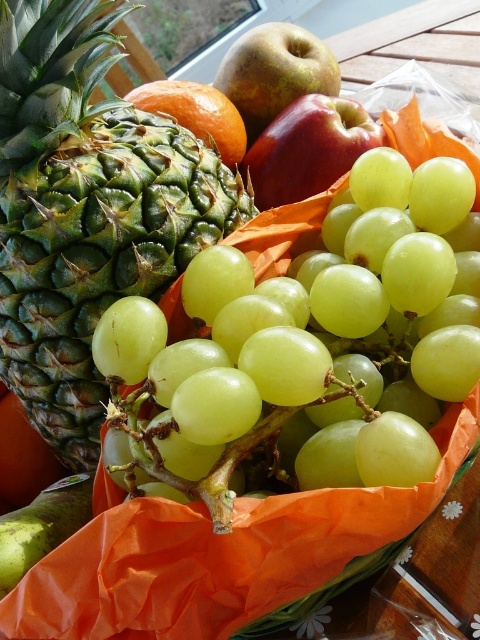
Does shiny red apple at center have a smaller size compared to orange matte at center?

Correct, shiny red apple at center occupies less space than orange matte at center.

Is shiny red apple at center to the right of orange matte at center from the viewer's perspective?

Indeed, shiny red apple at center is positioned on the right side of orange matte at center.

Between point (347, 140) and point (195, 108), which one is positioned behind?

The point (195, 108) is behind.

Locate an element on the screen. The image size is (480, 640). shiny red apple at center is located at coordinates (308, 148).

Which is more to the left, green textured pineapple at upper left or orange matte at center?

From the viewer's perspective, green textured pineapple at upper left appears more on the left side.

Can you confirm if green textured pineapple at upper left is positioned to the right of orange matte at center?

Incorrect, green textured pineapple at upper left is not on the right side of orange matte at center.

Between point (17, 292) and point (188, 90), which one is positioned in front?

Point (17, 292) is more forward.

You are a GUI agent. You are given a task and a screenshot of the screen. Output one action in this format:
    pyautogui.click(x=<x>, y=<y>)
    Task: Click on the green textured pineapple at upper left
    
    Given the screenshot: What is the action you would take?
    pyautogui.click(x=86, y=211)

Does shiny green apple at upper center appear on the right side of orange matte at center?

Yes, shiny green apple at upper center is to the right of orange matte at center.

What do you see at coordinates (275, 72) in the screenshot? I see `shiny green apple at upper center` at bounding box center [275, 72].

The image size is (480, 640). Find the location of `shiny green apple at upper center`. shiny green apple at upper center is located at coordinates (275, 72).